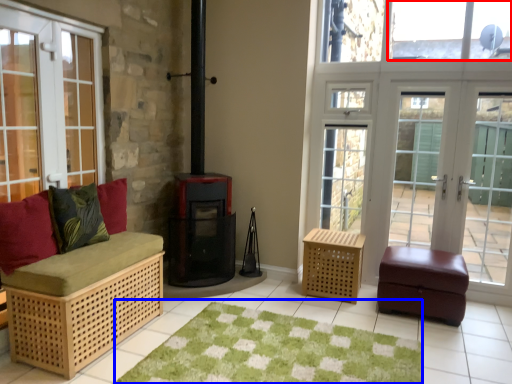
Question: Which point is closer to the camera, window screen (highlighted by a red box) or mat (highlighted by a blue box)?

Choices:
 (A) window screen
 (B) mat

Answer: (B)